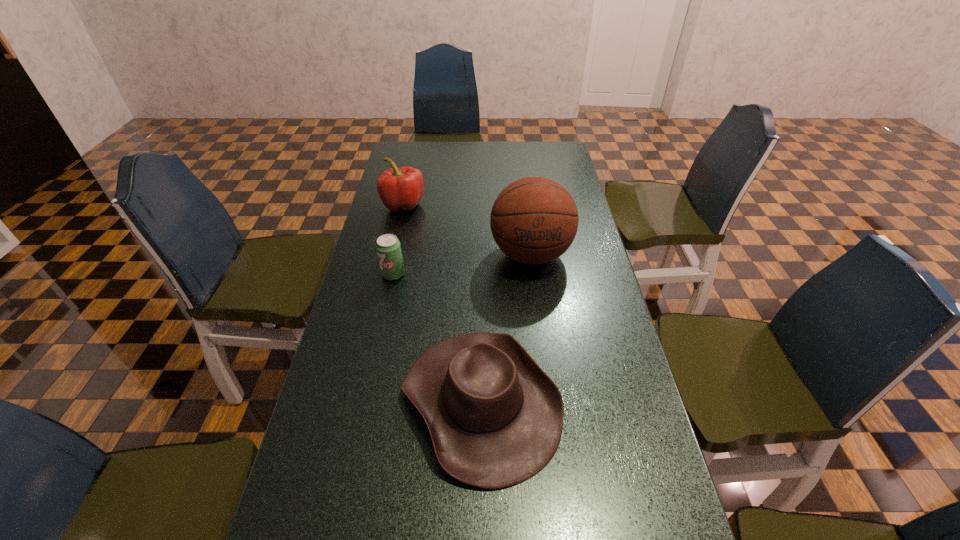
Identify the location of basketball. (534, 220).

The image size is (960, 540). I want to click on bell pepper, so click(402, 188).

Find the location of a particular element. This screenshot has width=960, height=540. the second tallest object is located at coordinates (402, 188).

Locate an element on the screen. This screenshot has height=540, width=960. cowboy hat is located at coordinates (495, 418).

In order to click on soda in this screenshot , I will do `click(388, 248)`.

Where is `vacant space located on the side with brand label of the basketball`? vacant space located on the side with brand label of the basketball is located at coordinates (542, 343).

Find the location of a particular element. The width and height of the screenshot is (960, 540). vacant area situated 0.110m on the right of the third shortest object is located at coordinates (455, 205).

Locate an element on the screen. The height and width of the screenshot is (540, 960). free point located on the back of the cowboy hat is located at coordinates (481, 248).

Locate an element on the screen. free space located 0.110m on the front of the soda is located at coordinates (386, 309).

Find the location of `bell pepper that is at the left edge`. bell pepper that is at the left edge is located at coordinates (402, 188).